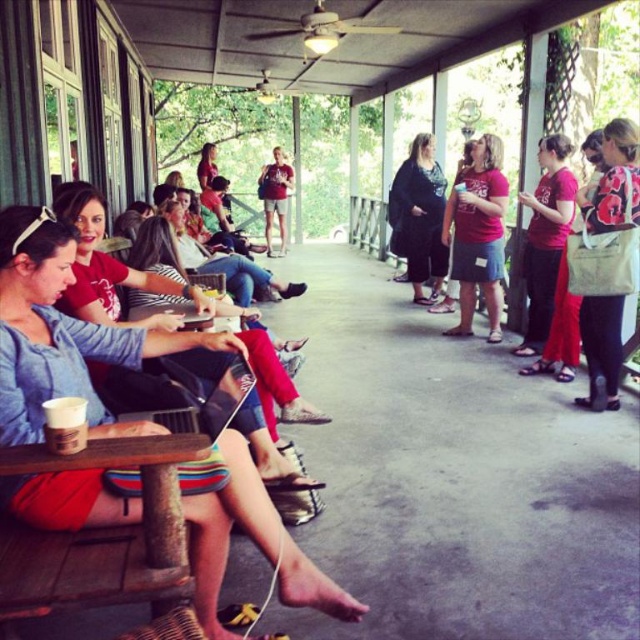
Is printed cotton shirt at center behind matte red shirt at center?

No, it is in front of matte red shirt at center.

Who is positioned more to the left, printed cotton shirt at center or matte red shirt at center?

Positioned to the left is matte red shirt at center.

Locate an element on the screen. The height and width of the screenshot is (640, 640). printed cotton shirt at center is located at coordinates (614, 179).

Find the location of a particular element. This screenshot has width=640, height=640. printed cotton shirt at center is located at coordinates (614, 179).

Is matte blue shirt at left to the right of printed cotton shirt at center from the viewer's perspective?

No, matte blue shirt at left is not to the right of printed cotton shirt at center.

Can you confirm if matte blue shirt at left is bigger than printed cotton shirt at center?

Indeed, matte blue shirt at left has a larger size compared to printed cotton shirt at center.

Which is in front, point (58, 266) or point (605, 320)?

Point (58, 266) is in front.

This screenshot has height=640, width=640. What are the coordinates of `matte blue shirt at left` in the screenshot? It's located at (64, 333).

Can you confirm if matte red shirt at center is shorter than black matte dress at center?

Correct, matte red shirt at center is not as tall as black matte dress at center.

In the scene shown: Who is lower down, matte red shirt at center or black matte dress at center?

matte red shirt at center is lower down.

Does point (547, 204) come closer to viewer compared to point (422, 221)?

Yes, point (547, 204) is closer to viewer.

You are a GUI agent. You are given a task and a screenshot of the screen. Output one action in this format:
    pyautogui.click(x=<x>, y=<y>)
    Task: Click on the matte red shirt at center
    This screenshot has width=640, height=640.
    Given the screenshot: What is the action you would take?
    pyautogui.click(x=545, y=237)